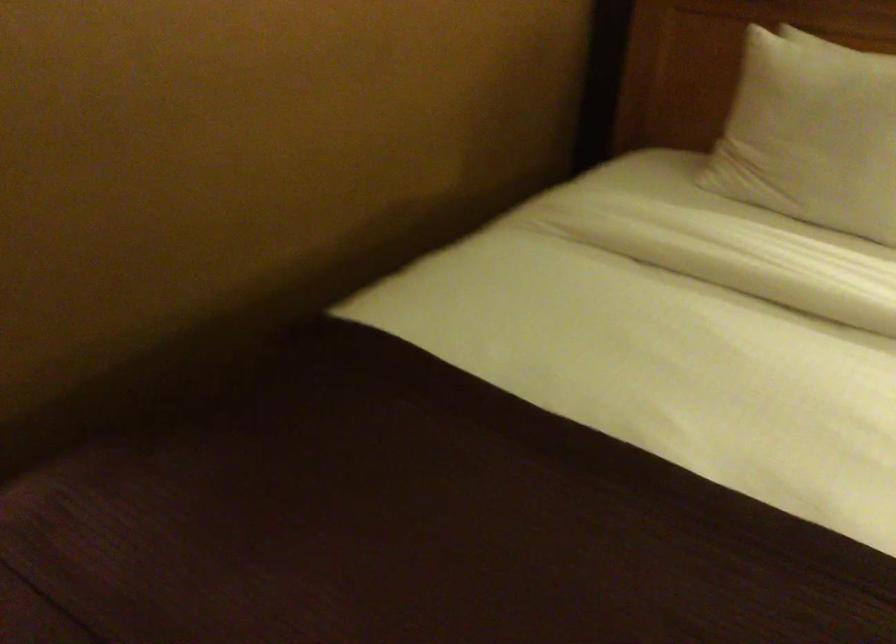
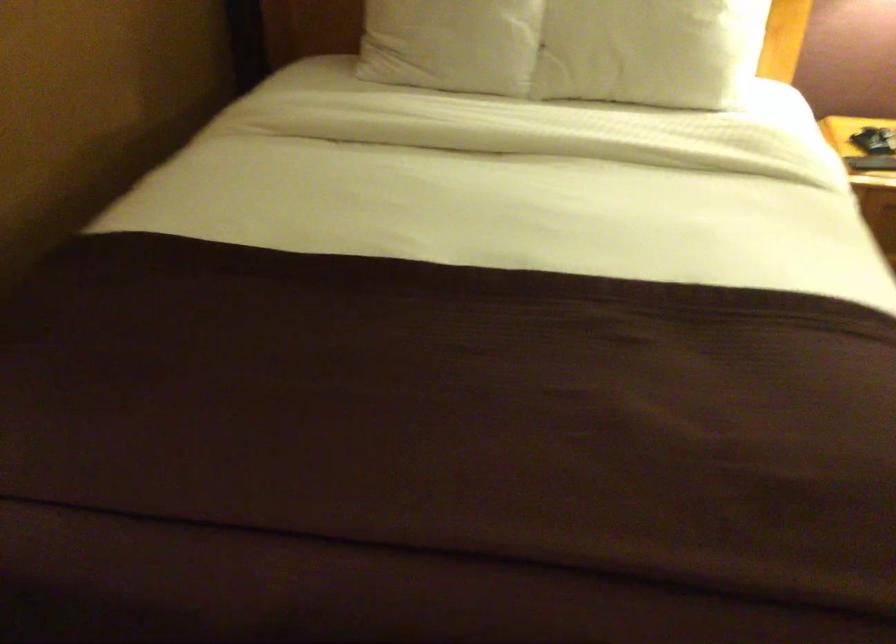
Locate, in the second image, the point that corresponds to point (823, 171) in the first image.

(452, 44)